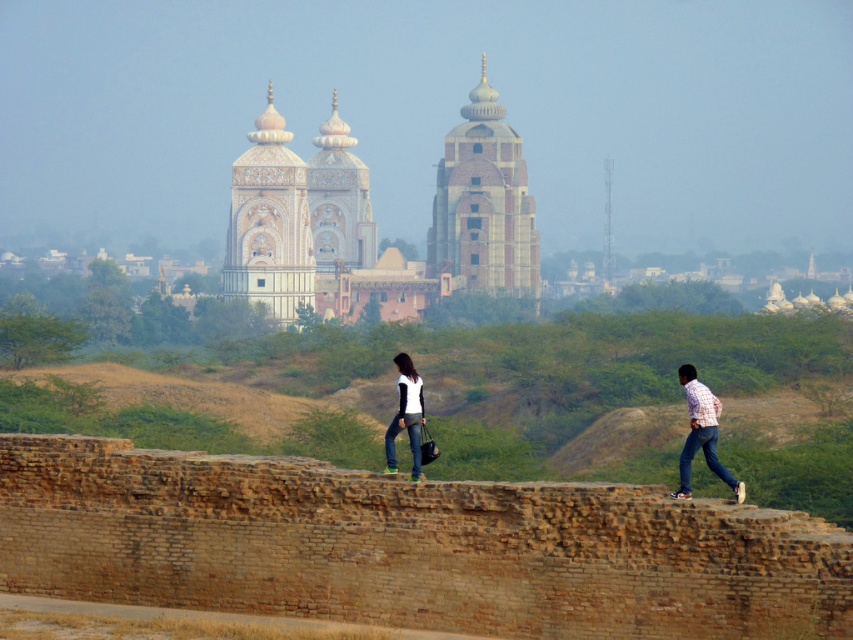
You are a tourist standing in front of the brick tower at center and the checkered shirt jeans at right. Which object is taller?

The brick tower at center is much taller than the checkered shirt jeans at right.

You are standing in front of the historical structure and notice the brick tower at center and the checkered shirt jeans at right. Which object is bigger in size?

The brick tower at center is larger in size compared to the checkered shirt jeans at right.

You are standing in front of the historical structure and see two people near the low brick wall. One is wearing jeans at center and the other is wearing checkered shirt jeans at right. From your perspective, which person is positioned lower relative to the other?

The jeans at center is located below checkered shirt jeans at right, so the person wearing jeans at center is positioned lower.